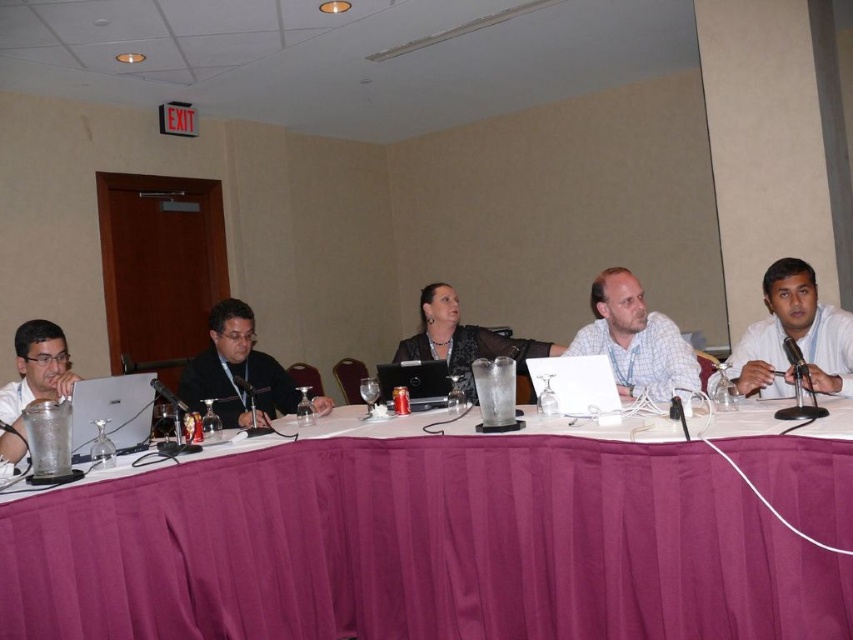
Who is shorter, white shirt at right or silver metallic laptop at left?

With less height is silver metallic laptop at left.

Locate an element on the screen. Image resolution: width=853 pixels, height=640 pixels. white shirt at right is located at coordinates (793, 337).

Who is more distant from viewer, (3, 451) or (440, 404)?

Positioned behind is point (440, 404).

Does point (21, 452) lie behind point (444, 392)?

No.

Locate an element on the screen. The image size is (853, 640). clear plastic cup at left is located at coordinates (33, 380).

In the scene shown: Between matte black suit at center and silver metallic laptop at left, which one has more height?

With more height is matte black suit at center.

Is matte black suit at center above silver metallic laptop at left?

No, matte black suit at center is not above silver metallic laptop at left.

Who is more distant from viewer, (225, 406) or (88, 403)?

Point (225, 406)

The width and height of the screenshot is (853, 640). In order to click on matte black suit at center in this screenshot , I will do (x=236, y=371).